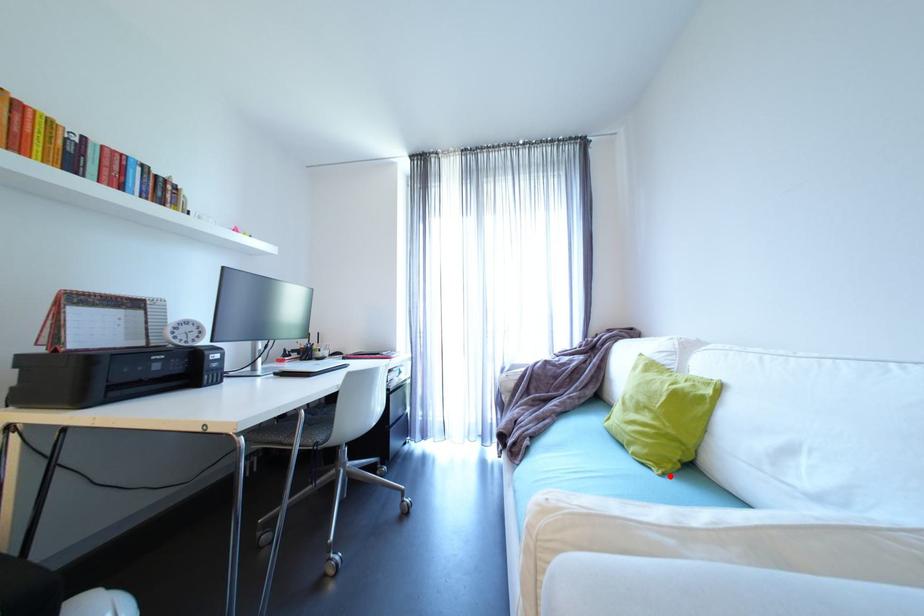
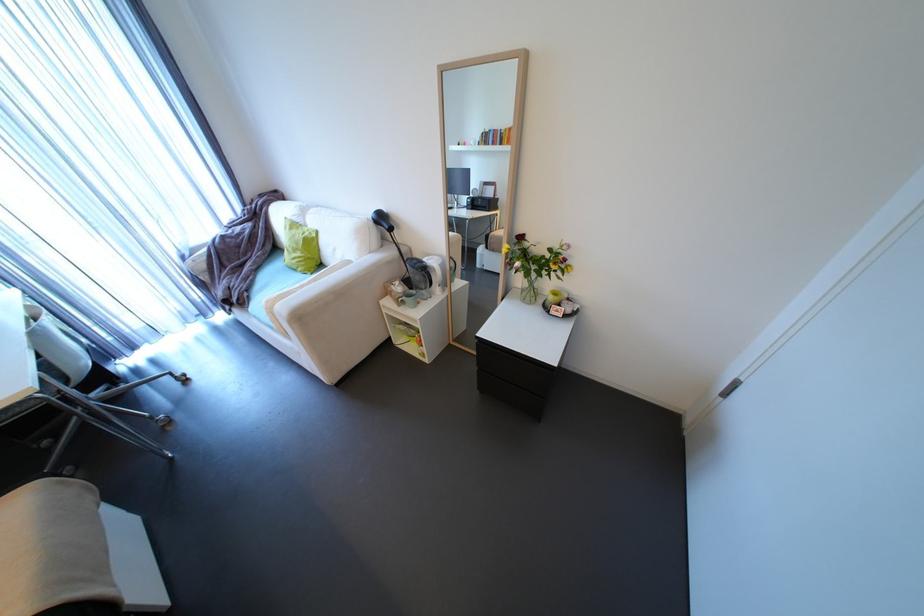
Question: I am providing you with two images of the same scene from different viewpoints. Given a red point in image1, look at the same physical point in image2. Is it:

Choices:
 (A) Closer to the viewpoint
 (B) Farther from the viewpoint

Answer: (B)